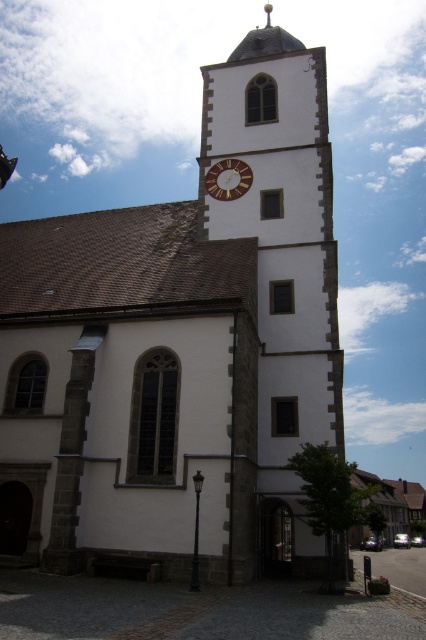
Who is lower down, white stone clock tower at center or gold metallic clock at center?

white stone clock tower at center is lower down.

Is white stone clock tower at center in front of gold metallic clock at center?

That is True.

At what (x,y) coordinates should I click in order to perform the action: click on white stone clock tower at center. Please return your answer as a coordinate pair (x, y). The image size is (426, 640). Looking at the image, I should click on click(282, 260).